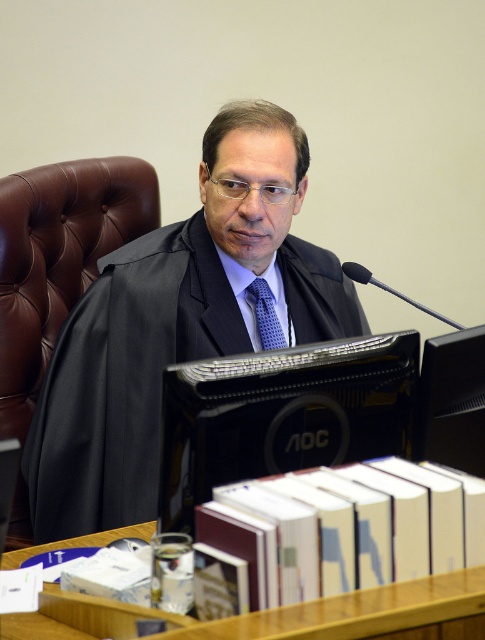
Question: Where is black matte business suit at center located in relation to wooden table at lower center in the image?

Choices:
 (A) above
 (B) below

Answer: (A)

Question: Which object appears farthest from the camera in this image?

Choices:
 (A) brown leather chair at left
 (B) wooden table at lower center
 (C) blue dotted tie at center
 (D) black matte business suit at center

Answer: (C)

Question: Which of the following is the farthest from the observer?

Choices:
 (A) wooden table at lower center
 (B) blue dotted tie at center
 (C) brown leather chair at left

Answer: (B)

Question: Is wooden table at lower center further to the viewer compared to blue dotted tie at center?

Choices:
 (A) no
 (B) yes

Answer: (A)

Question: Which of the following is the farthest from the observer?

Choices:
 (A) brown leather chair at left
 (B) black matte business suit at center
 (C) wooden table at lower center

Answer: (A)

Question: Is black matte business suit at center bigger than blue dotted tie at center?

Choices:
 (A) yes
 (B) no

Answer: (A)